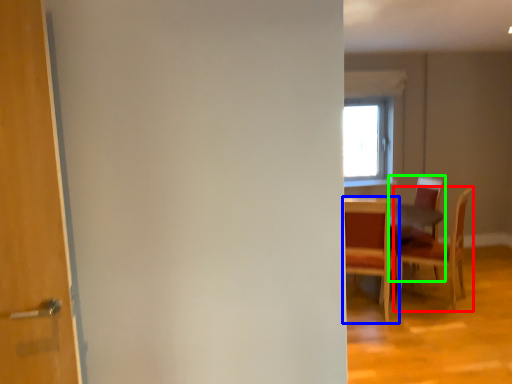
Question: Considering the real-world distances, which object is farthest from chair (highlighted by a red box)? chair (highlighted by a blue box) or chair (highlighted by a green box)?

Choices:
 (A) chair
 (B) chair

Answer: (A)